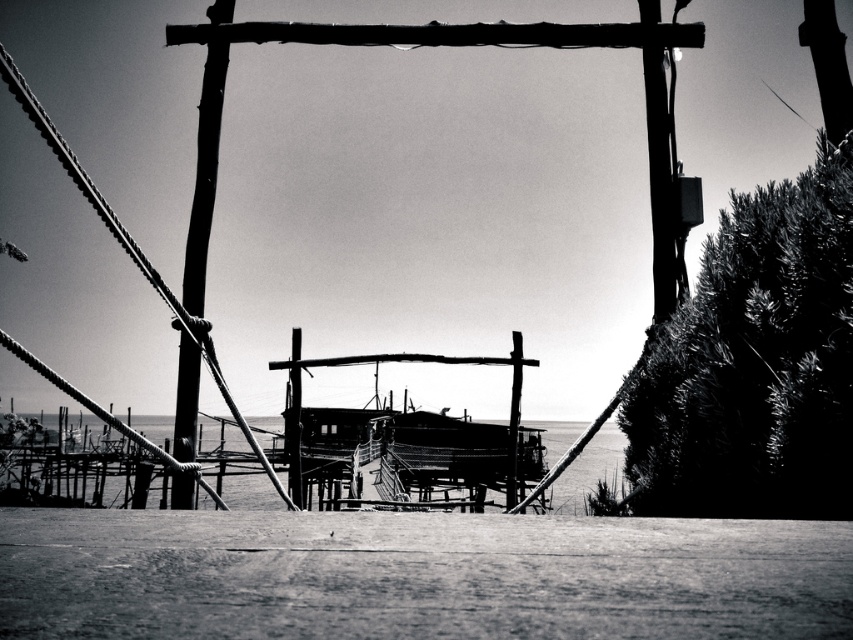
Between rustic wood telegraph pole at left and wooden hut at center, which one is positioned lower?

wooden hut at center

Consider the image. Between rustic wood telegraph pole at left and wooden hut at center, which one appears on the right side from the viewer's perspective?

wooden hut at center is more to the right.

Which is behind, point (183, 394) or point (350, 444)?

The point (350, 444) is more distant.

Image resolution: width=853 pixels, height=640 pixels. I want to click on rustic wood telegraph pole at left, so click(x=204, y=147).

Does wooden telegraph pole at center have a greater width compared to wooden hut at center?

Incorrect, wooden telegraph pole at center's width does not surpass wooden hut at center's.

Which is below, wooden telegraph pole at center or wooden hut at center?

wooden hut at center

Identify the location of wooden telegraph pole at center. The image size is (853, 640). (450, 45).

The height and width of the screenshot is (640, 853). I want to click on wooden telegraph pole at center, so click(x=450, y=45).

Who is higher up, rustic wood telegraph pole at left or wooden boat at center?

rustic wood telegraph pole at left is higher up.

Who is taller, rustic wood telegraph pole at left or wooden boat at center?

rustic wood telegraph pole at left

Between point (184, 435) and point (517, 406), which one is positioned in front?

Positioned in front is point (184, 435).

At what (x,y) coordinates should I click in order to perform the action: click on rustic wood telegraph pole at left. Please return your answer as a coordinate pair (x, y). The height and width of the screenshot is (640, 853). Looking at the image, I should click on (204, 147).